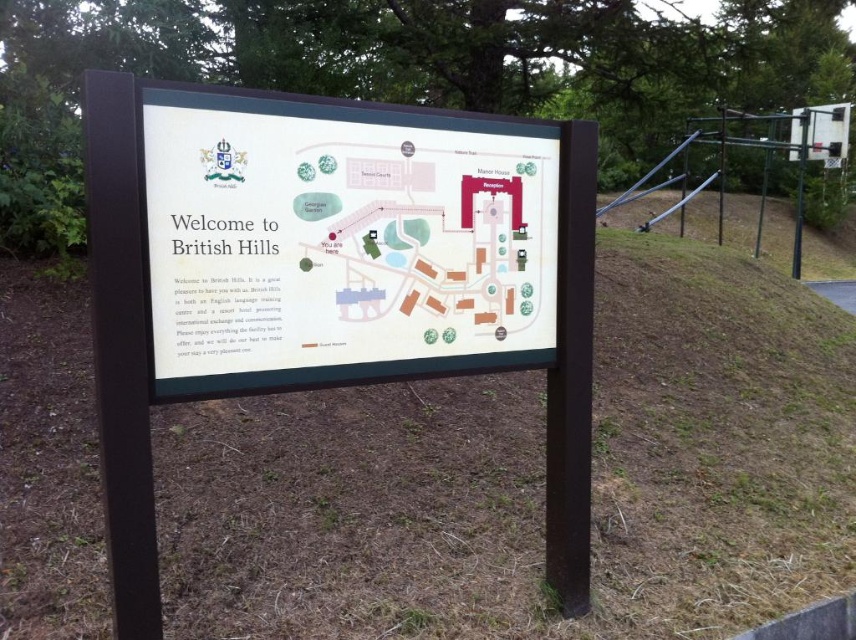
Can you confirm if white plastic map at center is positioned below white plastic sign at center?

Actually, white plastic map at center is above white plastic sign at center.

Is point (195, 92) positioned behind point (254, 129)?

That is False.

At what (x,y) coordinates should I click in order to perform the action: click on white plastic map at center. Please return your answer as a coordinate pair (x, y). Looking at the image, I should click on (342, 243).